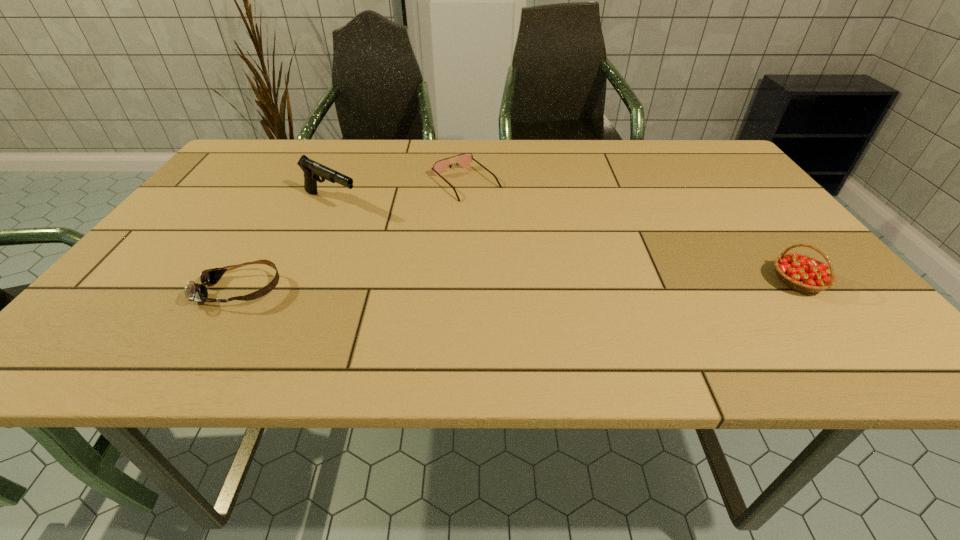
Locate an element on the screen. The image size is (960, 540). goggles is located at coordinates point(193,291).

The width and height of the screenshot is (960, 540). I want to click on the second tallest object, so click(x=800, y=272).

Find the location of a particular element. the rightmost object is located at coordinates (800, 272).

The image size is (960, 540). I want to click on gun, so click(x=312, y=170).

The height and width of the screenshot is (540, 960). I want to click on the third object from left to right, so 464,160.

You are a GUI agent. You are given a task and a screenshot of the screen. Output one action in this format:
    pyautogui.click(x=<x>, y=<y>)
    Task: Click on the vacant space situated on the front-facing side of the goggles
    This screenshot has height=540, width=960.
    Given the screenshot: What is the action you would take?
    pyautogui.click(x=142, y=291)

Where is `vacant region located 0.100m on the front-facing side of the goggles`? This screenshot has width=960, height=540. vacant region located 0.100m on the front-facing side of the goggles is located at coordinates (153, 291).

You are a GUI agent. You are given a task and a screenshot of the screen. Output one action in this format:
    pyautogui.click(x=<x>, y=<y>)
    Task: Click on the free location located 0.160m on the front-facing side of the goggles
    
    Given the screenshot: What is the action you would take?
    pyautogui.click(x=123, y=291)

I want to click on vacant space situated 0.250m on the back of the rightmost object, so click(x=734, y=201).

Identify the location of vacant space located 0.120m at the aiming end of the tallest object. The image size is (960, 540). (388, 228).